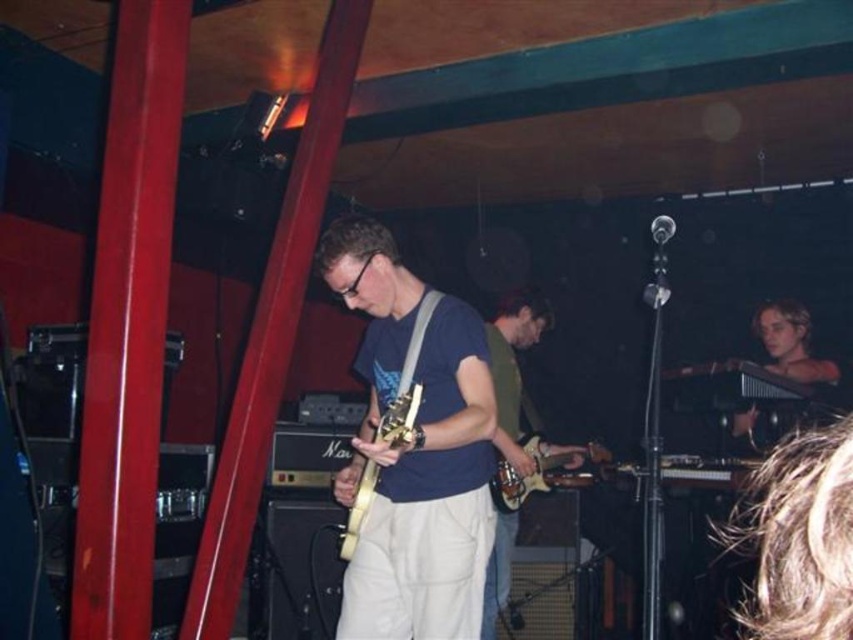
Question: Which point appears farthest from the camera in this image?

Choices:
 (A) (552, 481)
 (B) (360, 486)
 (C) (798, 355)
 (D) (526, 324)

Answer: (A)

Question: Is wooden electric guitar at center positioned behind gold metallic guitar at center?

Choices:
 (A) yes
 (B) no

Answer: (A)

Question: Can you confirm if wooden electric guitar at center is smaller than gold metallic guitar at center?

Choices:
 (A) no
 (B) yes

Answer: (A)

Question: Which object is the closest to the matte green shirt at center?

Choices:
 (A) wooden electric guitar at center
 (B) matte blue shirt at center

Answer: (A)

Question: Can you confirm if matte green shirt at center is smaller than gold metallic guitar at center?

Choices:
 (A) yes
 (B) no

Answer: (B)

Question: Which object is farther from the camera taking this photo?

Choices:
 (A) light brown wooden harp at right
 (B) matte blue shirt at center

Answer: (A)